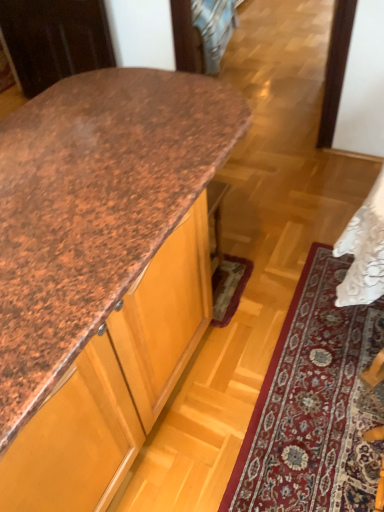
Question: Should I look upward or downward to see carpet with intricate patterns at lower right?

Choices:
 (A) up
 (B) down

Answer: (B)

Question: Can you confirm if carpet with intricate patterns at lower right is shorter than brown speckled laminate countertop at upper left?

Choices:
 (A) no
 (B) yes

Answer: (B)

Question: Does carpet with intricate patterns at lower right lie behind brown speckled laminate countertop at upper left?

Choices:
 (A) yes
 (B) no

Answer: (A)

Question: Is brown speckled laminate countertop at upper left a part of carpet with intricate patterns at lower right?

Choices:
 (A) no
 (B) yes

Answer: (A)

Question: Can we say carpet with intricate patterns at lower right lies outside brown speckled laminate countertop at upper left?

Choices:
 (A) yes
 (B) no

Answer: (A)

Question: Is carpet with intricate patterns at lower right aimed at brown speckled laminate countertop at upper left?

Choices:
 (A) yes
 (B) no

Answer: (A)

Question: Can you confirm if carpet with intricate patterns at lower right is wider than brown speckled laminate countertop at upper left?

Choices:
 (A) no
 (B) yes

Answer: (A)

Question: Considering the relative sizes of brown speckled laminate countertop at upper left and carpet with intricate patterns at lower right in the image provided, is brown speckled laminate countertop at upper left bigger than carpet with intricate patterns at lower right?

Choices:
 (A) no
 (B) yes

Answer: (B)

Question: Is brown speckled laminate countertop at upper left completely or partially outside of carpet with intricate patterns at lower right?

Choices:
 (A) yes
 (B) no

Answer: (A)

Question: Does brown speckled laminate countertop at upper left appear on the right side of carpet with intricate patterns at lower right?

Choices:
 (A) yes
 (B) no

Answer: (B)

Question: Does brown speckled laminate countertop at upper left have a greater height compared to carpet with intricate patterns at lower right?

Choices:
 (A) no
 (B) yes

Answer: (B)

Question: Is brown speckled laminate countertop at upper left surrounding carpet with intricate patterns at lower right?

Choices:
 (A) yes
 (B) no

Answer: (B)

Question: Does brown speckled laminate countertop at upper left lie in front of carpet with intricate patterns at lower right?

Choices:
 (A) yes
 (B) no

Answer: (A)

Question: In terms of width, does brown speckled laminate countertop at upper left look wider or thinner when compared to carpet with intricate patterns at lower right?

Choices:
 (A) thin
 (B) wide

Answer: (B)